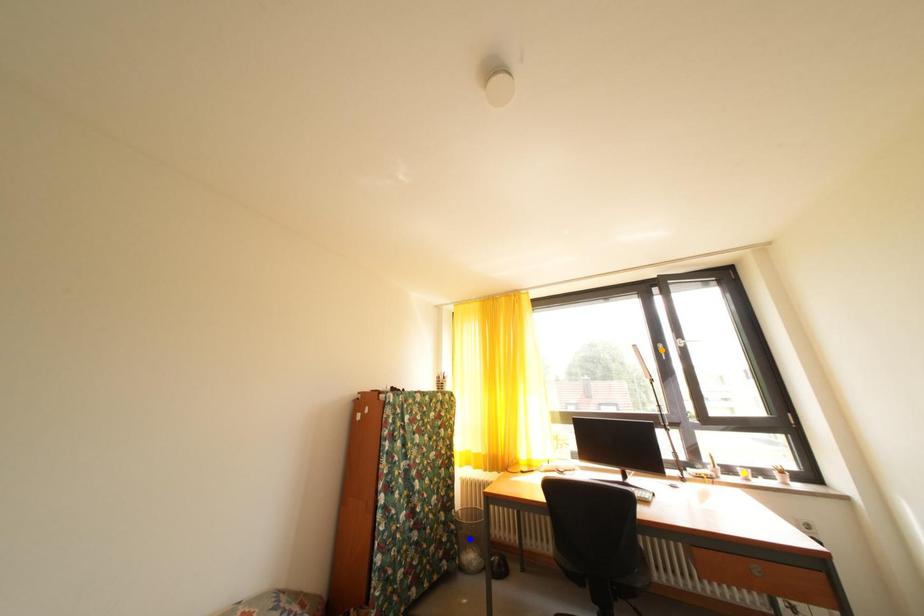
Order these from nearest to farthest:
yellow point | blue point | orange point

1. yellow point
2. orange point
3. blue point